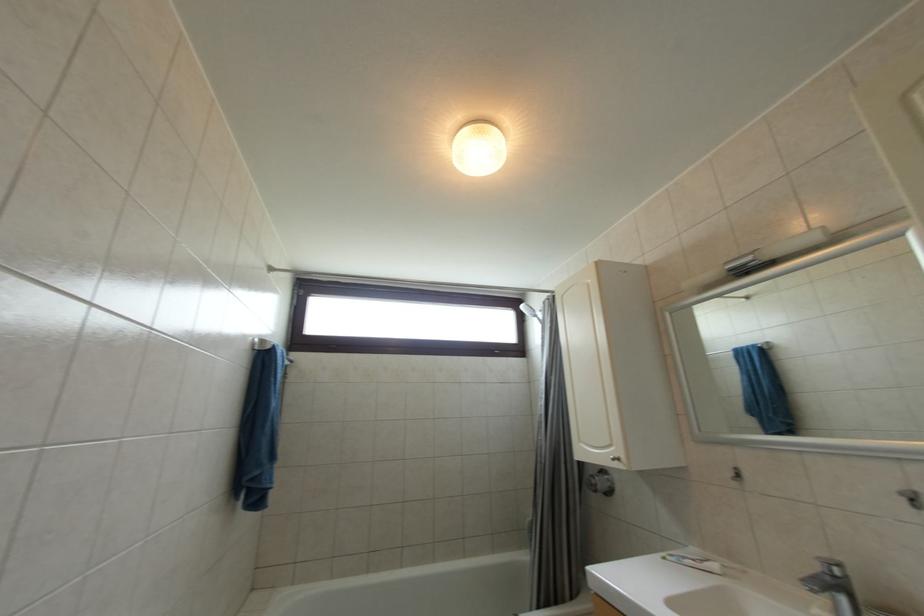
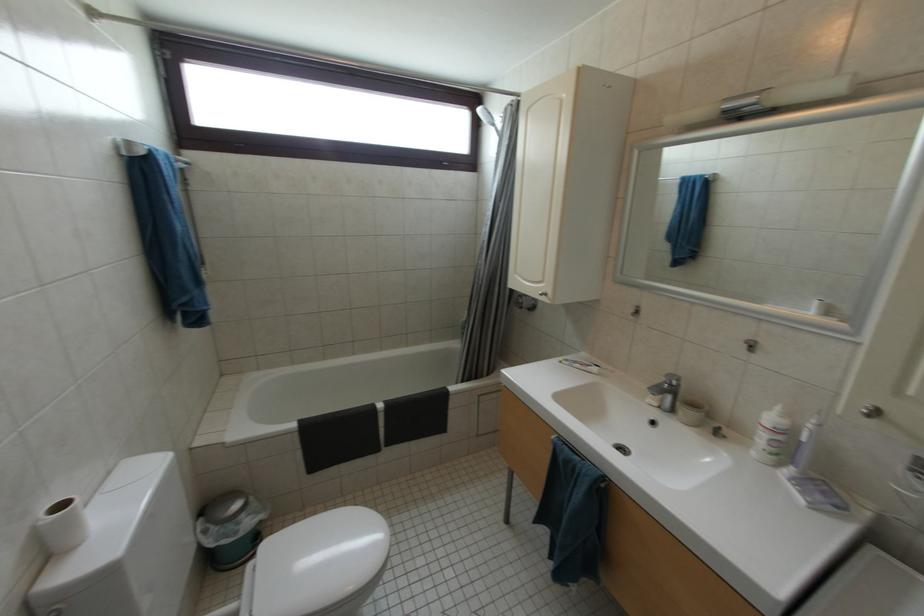
Question: Based on the continuous images, in which direction is the camera rotating? Reply with the corresponding letter.

Choices:
 (A) Left
 (B) Right
 (C) Up
 (D) Down

Answer: (D)